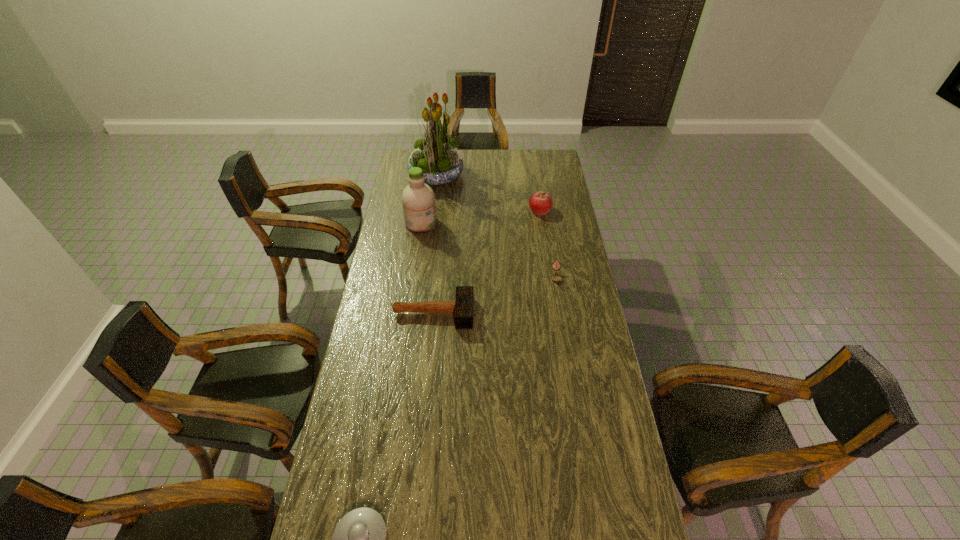
Where is `blank space at the far edge of the desktop`? The image size is (960, 540). blank space at the far edge of the desktop is located at coordinates (513, 159).

This screenshot has width=960, height=540. What are the coordinates of `free point at the left edge` in the screenshot? It's located at pos(396,225).

What are the coordinates of `vacant space at the right edge of the desktop` in the screenshot? It's located at (573, 258).

The width and height of the screenshot is (960, 540). Identify the location of free space between the mallet and the compass. (495, 295).

Identify the location of empty location between the tallest object and the mallet. This screenshot has height=540, width=960. (435, 244).

I want to click on vacant space in between the fourth farthest object and the apple, so pos(548,244).

Identify the location of free space between the apple and the fourth tallest object. The width and height of the screenshot is (960, 540). (487, 261).

Identify the location of vacant region between the apple and the farthest object. The height and width of the screenshot is (540, 960). [488, 192].

The width and height of the screenshot is (960, 540). I want to click on vacant area that lies between the third shortest object and the apple, so [x=487, y=261].

Locate an element on the screen. Image resolution: width=960 pixels, height=540 pixels. free spot between the apple and the compass is located at coordinates (548, 244).